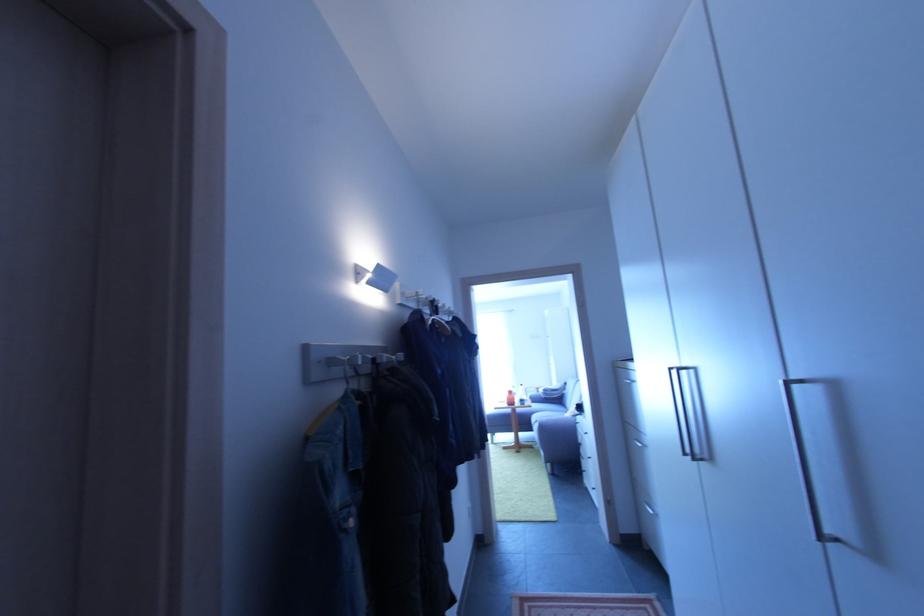
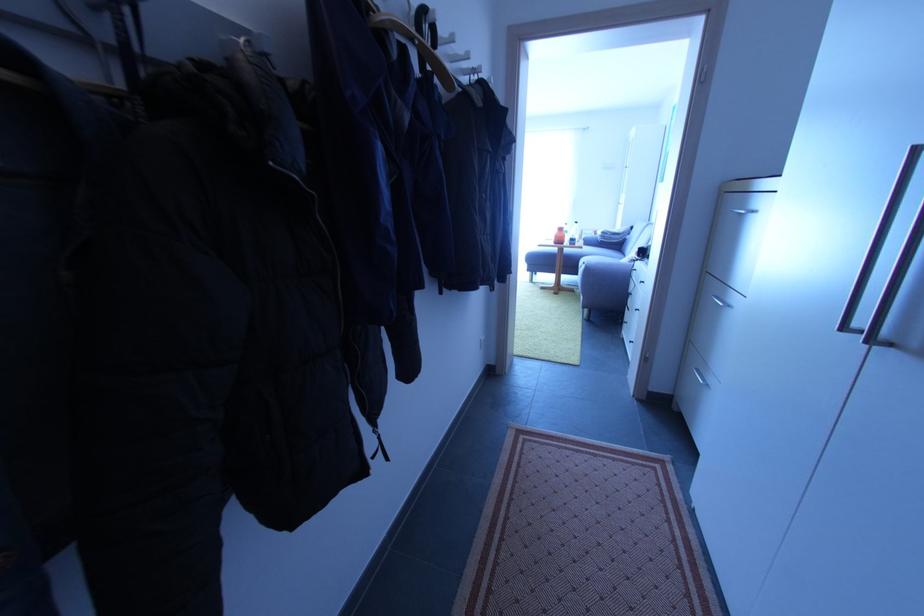
Question: Which direction would the cameraman need to move to produce the second image? Reply with the corresponding letter.

Choices:
 (A) Left
 (B) Right
 (C) Forward
 (D) Backward

Answer: (C)